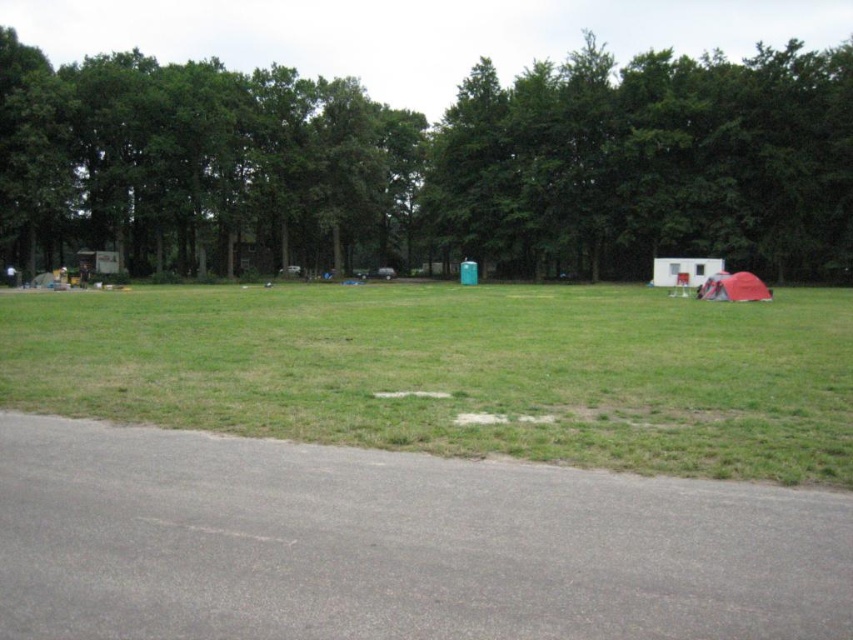
You are planning to set up a picnic area between the green leafy tree at upper center and the red fabric tent at lower right. The picnic blanket you have is 200 feet long. Will the blanket reach from the tree to the tent?

The distance between the green leafy tree at upper center and the red fabric tent at lower right is 180.33 feet. Since the picnic blanket is 200 feet long, it will easily reach from the tree to the tent with some extra length remaining.

You are standing at the bottom left corner of the grassy area and want to walk towards the point at the center of the frame. There are two points marked on your path. Which point should you step on first, point at [657,388] or point at [758,291]?

You should step on point at [657,388] first because it is in front of point at [758,291] along your path.

You are standing at the bottom left corner of the grassy area and want to walk straight towards the green leafy tree at upper center. Will you have to navigate around any obstacles along the way?

The green leafy tree at upper center is located at point [431,164], but there is a small red tent and a white trailer parked nearby in the midground. Since the paved road curves gently from the bottom left corner towards the center, you might need to follow the road or detour around the tents and trailers to reach the tree without obstacles.